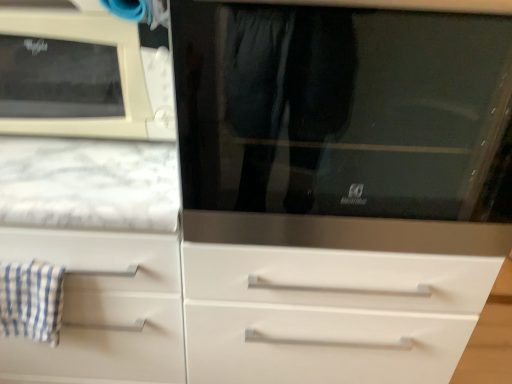
You are a GUI agent. You are given a task and a screenshot of the screen. Output one action in this format:
    pyautogui.click(x=<x>, y=<y>)
    Task: Click on the beige plastic microwave at upper left
    
    Given the screenshot: What is the action you would take?
    pyautogui.click(x=75, y=76)

You are a GUI agent. You are given a task and a screenshot of the screen. Output one action in this format:
    pyautogui.click(x=<x>, y=<y>)
    Task: Click on the blue checkered cloth at left
    The height and width of the screenshot is (384, 512).
    Given the screenshot: What is the action you would take?
    pyautogui.click(x=31, y=301)

Which object is thinner, beige plastic microwave at upper left or blue checkered cloth at left?

With smaller width is blue checkered cloth at left.

Does point (12, 103) appear closer or farther from the camera than point (46, 267)?

Clearly, point (12, 103) is more distant from the camera than point (46, 267).

From a real-world perspective, is beige plastic microwave at upper left physically above blue checkered cloth at left?

Yes, from a real-world perspective, beige plastic microwave at upper left is above blue checkered cloth at left.

From the image's perspective, is stainless steel microwave at center on beige plastic microwave at upper left?

No, from the image's perspective, stainless steel microwave at center is not over beige plastic microwave at upper left.

Could you tell me if stainless steel microwave at center is facing beige plastic microwave at upper left?

No, stainless steel microwave at center is not aimed at beige plastic microwave at upper left.

Considering the sizes of beige plastic microwave at upper left and stainless steel microwave at center in the image, is beige plastic microwave at upper left taller or shorter than stainless steel microwave at center?

In the image, beige plastic microwave at upper left appears to be shorter than stainless steel microwave at center.

Considering the relative positions of beige plastic microwave at upper left and stainless steel microwave at center in the image provided, is beige plastic microwave at upper left to the left or to the right of stainless steel microwave at center?

From the image, it's evident that beige plastic microwave at upper left is to the left of stainless steel microwave at center.

From the image's perspective, is beige plastic microwave at upper left above or below stainless steel microwave at center?

beige plastic microwave at upper left is above stainless steel microwave at center.

Which of these two, stainless steel microwave at center or blue checkered cloth at left, is bigger?

stainless steel microwave at center is bigger.

Would you say stainless steel microwave at center is inside or outside blue checkered cloth at left?

stainless steel microwave at center exists outside the volume of blue checkered cloth at left.

Considering the points (258, 186) and (39, 323), which point is in front, point (258, 186) or point (39, 323)?

The point (258, 186) is closer to the camera.

In order to click on bath towel that is under the stainless steel microwave at center (from a real-world perspective) in this screenshot , I will do `click(31, 301)`.

Does blue checkered cloth at left have a greater height compared to stainless steel microwave at center?

No, blue checkered cloth at left is not taller than stainless steel microwave at center.

Would you consider blue checkered cloth at left to be distant from stainless steel microwave at center?

No, blue checkered cloth at left is not far from stainless steel microwave at center.

Is blue checkered cloth at left inside the boundaries of beige plastic microwave at upper left, or outside?

blue checkered cloth at left is not inside beige plastic microwave at upper left, it's outside.

Between blue checkered cloth at left and beige plastic microwave at upper left, which one appears on the left side from the viewer's perspective?

blue checkered cloth at left.

This screenshot has height=384, width=512. Identify the location of bath towel behind the beige plastic microwave at upper left. (31, 301).

From the image's perspective, which is above, blue checkered cloth at left or beige plastic microwave at upper left?

beige plastic microwave at upper left appears higher in the image.

The height and width of the screenshot is (384, 512). In the image, there is a beige plastic microwave at upper left. What are the coordinates of `bath towel below it (from a real-world perspective)` in the screenshot? It's located at (31, 301).

Find the location of `glass door in front of the beige plastic microwave at upper left`. glass door in front of the beige plastic microwave at upper left is located at coordinates (343, 110).

Looking at the image, which one is located closer to stainless steel microwave at center, beige plastic microwave at upper left or blue checkered cloth at left?

beige plastic microwave at upper left.

From the picture: Looking at the image, which one is located further to stainless steel microwave at center, blue checkered cloth at left or beige plastic microwave at upper left?

blue checkered cloth at left is further to stainless steel microwave at center.

Estimate the real-world distances between objects in this image. Which object is further from blue checkered cloth at left, stainless steel microwave at center or beige plastic microwave at upper left?

stainless steel microwave at center lies further to blue checkered cloth at left than the other object.

Estimate the real-world distances between objects in this image. Which object is closer to blue checkered cloth at left, beige plastic microwave at upper left or stainless steel microwave at center?

Based on the image, beige plastic microwave at upper left appears to be nearer to blue checkered cloth at left.

From the picture: Looking at the image, which one is located closer to beige plastic microwave at upper left, blue checkered cloth at left or stainless steel microwave at center?

Based on the image, stainless steel microwave at center appears to be nearer to beige plastic microwave at upper left.

When comparing their distances from beige plastic microwave at upper left, does stainless steel microwave at center or blue checkered cloth at left seem closer?

stainless steel microwave at center.

The height and width of the screenshot is (384, 512). Identify the location of microwave oven between blue checkered cloth at left and stainless steel microwave at center from left to right. [75, 76].